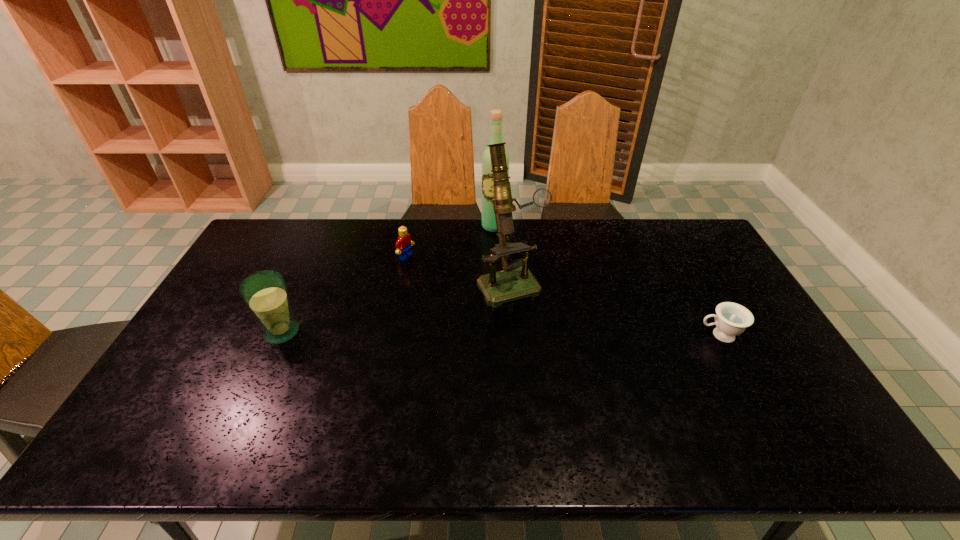
Locate an element on the screen. This screenshot has width=960, height=540. free space that satisfies the following two spatial constraints: 1. on the back side of the microscope; 2. on the left side of the leftmost object is located at coordinates (304, 281).

Locate an element on the screen. This screenshot has width=960, height=540. free space that satisfies the following two spatial constraints: 1. on the front side of the rightmost object; 2. on the side of the farthest object with the handle is located at coordinates (498, 335).

Where is `blank space that satisfies the following two spatial constraints: 1. on the front side of the farthest object; 2. on the right side of the microscope`? Image resolution: width=960 pixels, height=540 pixels. blank space that satisfies the following two spatial constraints: 1. on the front side of the farthest object; 2. on the right side of the microscope is located at coordinates (496, 281).

This screenshot has width=960, height=540. I want to click on vacant region that satisfies the following two spatial constraints: 1. on the front side of the shortest object; 2. on the side of the microscope with the handle, so (515, 335).

This screenshot has width=960, height=540. I want to click on vacant region that satisfies the following two spatial constraints: 1. on the front side of the rightmost object; 2. on the side of the glass with the handle, so click(x=280, y=335).